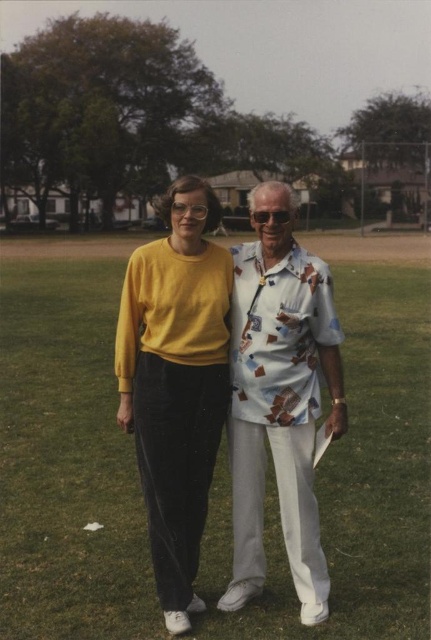
Question: Does matte yellow sweater at center appear on the left side of printed cotton shirt at center?

Choices:
 (A) yes
 (B) no

Answer: (A)

Question: From the image, what is the correct spatial relationship of green grass at center in relation to matte yellow sweater at center?

Choices:
 (A) right
 (B) left

Answer: (A)

Question: Which of the following is the farthest from the observer?

Choices:
 (A) green grass at center
 (B) matte yellow sweater at center
 (C) printed cotton shirt at center

Answer: (C)

Question: Which point appears farthest from the camera in this image?

Choices:
 (A) (283, 371)
 (B) (149, 490)
 (C) (74, 406)

Answer: (C)

Question: Can you confirm if green grass at center is smaller than printed cotton shirt at center?

Choices:
 (A) no
 (B) yes

Answer: (A)

Question: Which point is farther from the camera taking this photo?

Choices:
 (A) 184,204
 (B) 312,333
 (C) 55,509

Answer: (C)